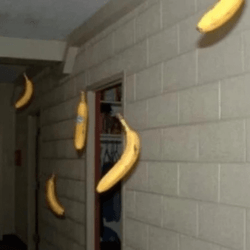
Where is `books on shelf in closet`? books on shelf in closet is located at coordinates (110, 125).